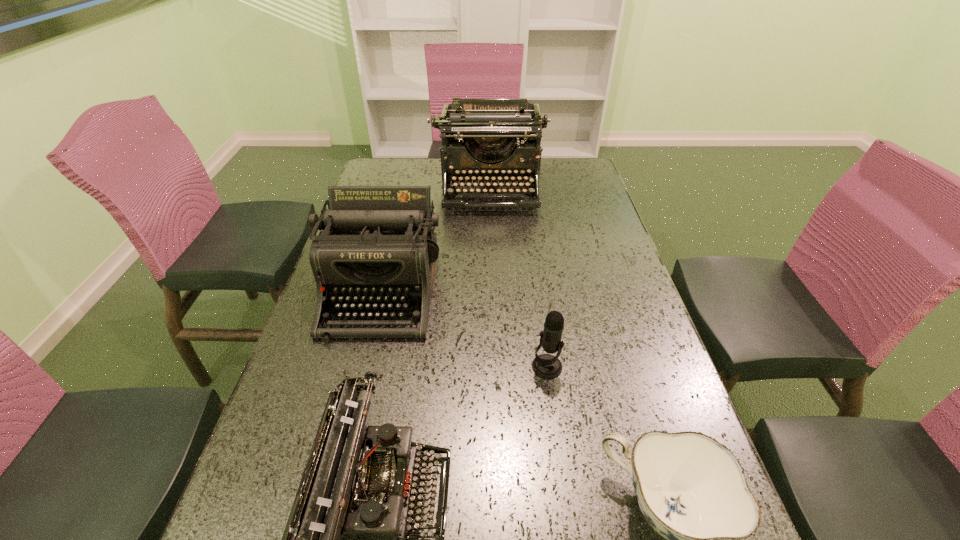
This screenshot has width=960, height=540. What are the coordinates of `object that stands as the fourth closest to the microphone` in the screenshot? It's located at (479, 140).

Locate which typewriter ranks second in proximity to the fourth nearest object. Please provide its 2D coordinates. Your answer should be formatted as a tuple, i.e. [(x, y)], where the tuple contains the x and y coordinates of a point satisfying the conditions above.

[(345, 539)]

Identify which typewriter is the second nearest to the nearest typewriter. Please provide its 2D coordinates. Your answer should be formatted as a tuple, i.e. [(x, y)], where the tuple contains the x and y coordinates of a point satisfying the conditions above.

[(479, 140)]